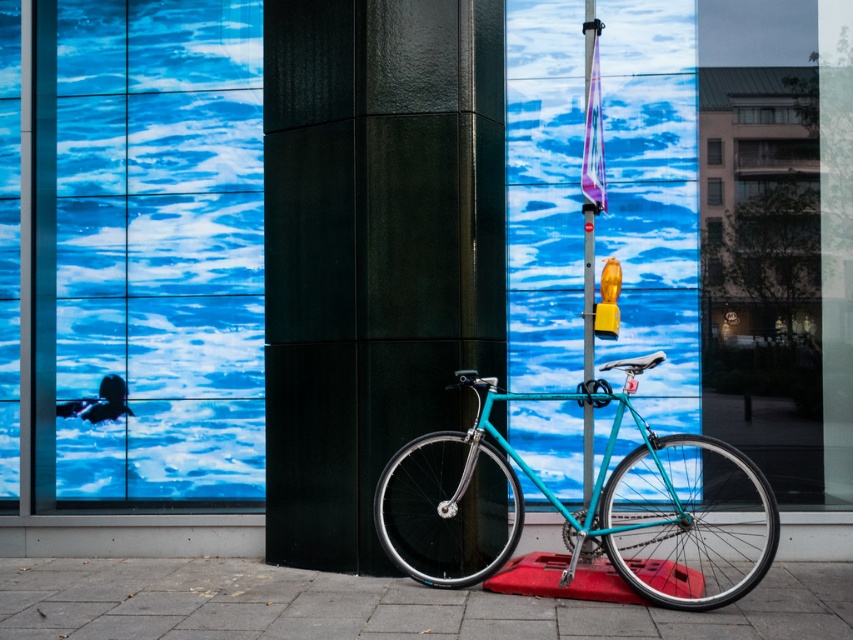
Question: Which point appears farthest from the camera in this image?

Choices:
 (A) (498, 508)
 (B) (167, 577)

Answer: (B)

Question: Observing the image, what is the correct spatial positioning of glossy black pillar at center in reference to smooth concrete pavement at lower center?

Choices:
 (A) left
 (B) right

Answer: (A)

Question: Is teal matte bicycle at center to the right of smooth concrete pavement at lower center from the viewer's perspective?

Choices:
 (A) no
 (B) yes

Answer: (B)

Question: Does teal matte bicycle at center appear on the right side of smooth concrete pavement at lower center?

Choices:
 (A) yes
 (B) no

Answer: (A)

Question: Which point is farther to the camera?

Choices:
 (A) smooth concrete pavement at lower center
 (B) glossy black pillar at center
 (C) teal matte bicycle at center

Answer: (B)

Question: Among these objects, which one is nearest to the camera?

Choices:
 (A) smooth concrete pavement at lower center
 (B) teal matte bicycle at center
 (C) glossy black pillar at center

Answer: (A)